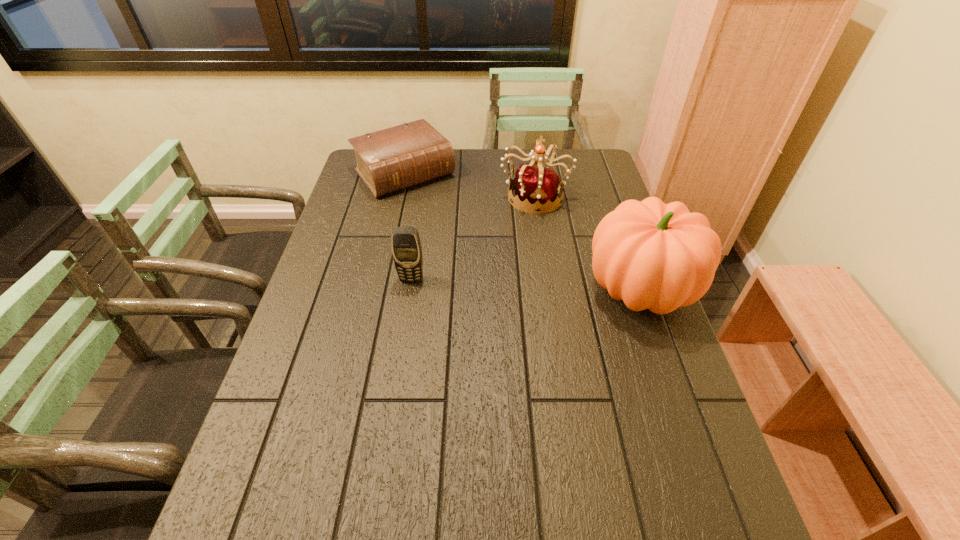
Find the location of a particular element. cellular telephone is located at coordinates (406, 247).

You are a GUI agent. You are given a task and a screenshot of the screen. Output one action in this format:
    pyautogui.click(x=<x>, y=<y>)
    Task: Click on the pumpkin
    
    Given the screenshot: What is the action you would take?
    tap(652, 255)

Identify the location of tiara. This screenshot has width=960, height=540. (533, 184).

You are a GUI agent. You are given a task and a screenshot of the screen. Output one action in this format:
    pyautogui.click(x=<x>, y=<y>)
    Task: Click on the Bible
    
    Given the screenshot: What is the action you would take?
    pyautogui.click(x=393, y=159)

Image resolution: width=960 pixels, height=540 pixels. In order to click on vacant space situated on the front face of the cellular telephone in this screenshot , I will do `click(400, 353)`.

Locate an element on the screen. Image resolution: width=960 pixels, height=540 pixels. vacant point located 0.270m on the back of the pumpkin is located at coordinates (608, 199).

This screenshot has height=540, width=960. What are the coordinates of `vacant space situated 0.090m on the front-facing side of the third shortest object` in the screenshot? It's located at (537, 234).

In order to click on free space located on the front-facing side of the third shortest object in this screenshot , I will do coord(540,269).

Identify the location of free spot located 0.170m on the front-facing side of the third shortest object. (539, 251).

In order to click on blank space located 0.250m on the spine side of the shortest object in this screenshot , I will do `click(462, 238)`.